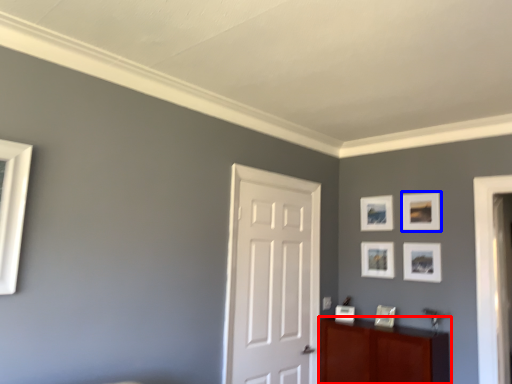
Question: Which object is further to the camera taking this photo, cabinetry (highlighted by a red box) or picture frame (highlighted by a blue box)?

Choices:
 (A) cabinetry
 (B) picture frame

Answer: (B)